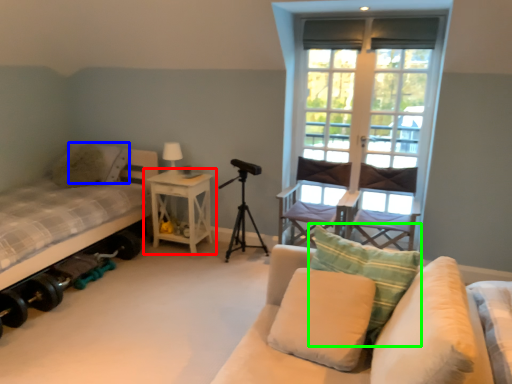
Question: Based on their relative distances, which object is farther from nightstand (highlighted by a red box)? Choose from pillow (highlighted by a blue box) and pillow (highlighted by a green box).

Choices:
 (A) pillow
 (B) pillow

Answer: (B)